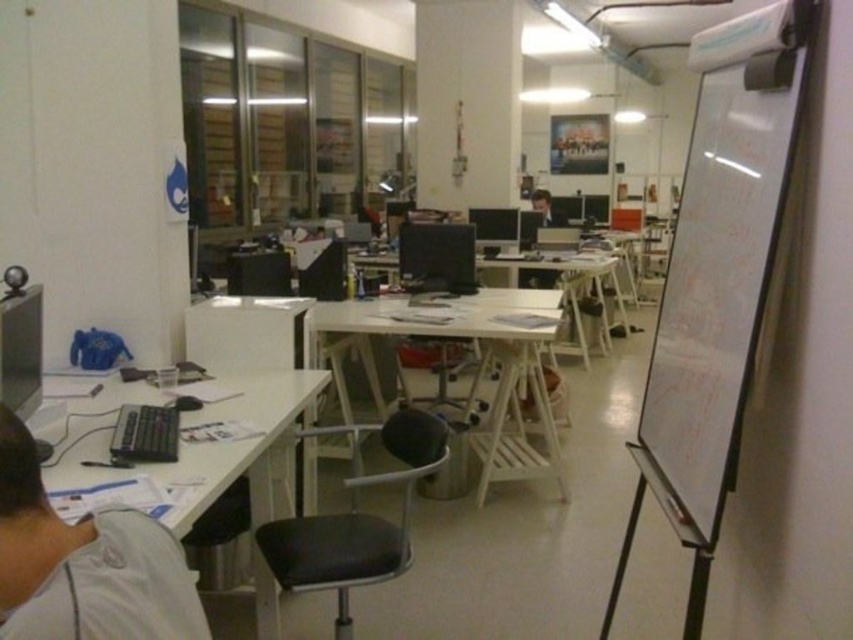
You are standing in the office and want to take a photo of both the point at location [772,208] and the point at [265,387]. Which point will appear larger in the photo?

The point at location [772,208] will appear larger in the photo because it is closer to the camera than the point at [265,387].

You are a delivery person who just arrived at the office. You need to place a package on the nearest desk or the white matte whiteboard at right. Which one is closer to you?

The white matte whiteboard at right is 1.49 meters from the camera, so it is closer than any desk in the office. Therefore, the package should be placed on the white matte whiteboard at right.

You are an office worker who wants to know if your gray fabric shirt at lower left can fit on the white wood computer desk at center without overlapping the edges. Can it?

The gray fabric shirt at lower left is narrower than the white wood computer desk at center, so it can fit without overlapping the edges.